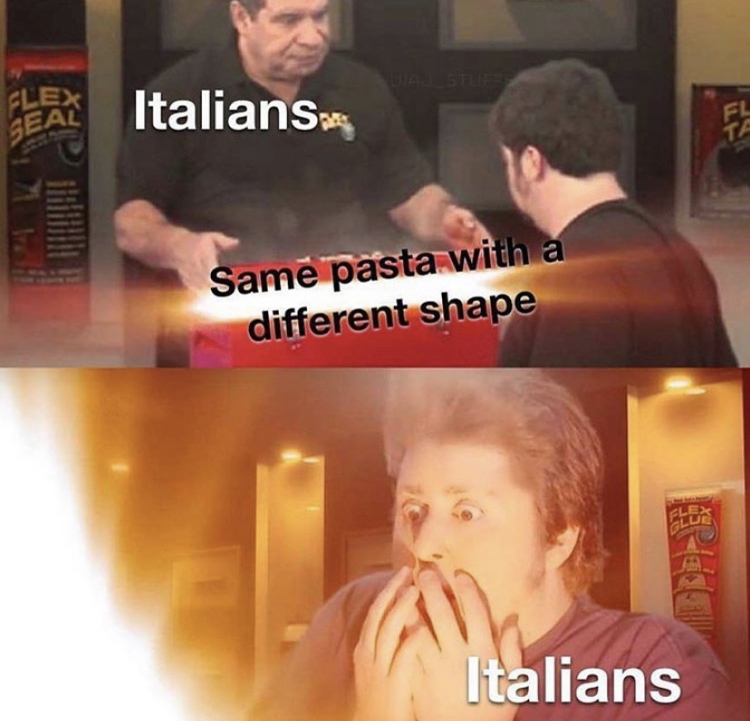
Identify the location of door. (476, 45).